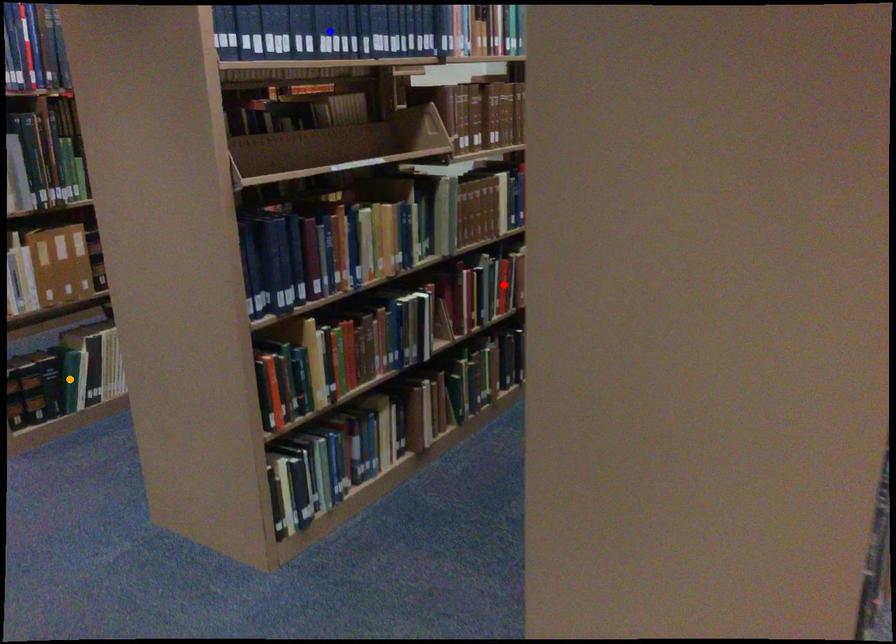
Order these from nearest to farthest:
blue point, red point, orange point

blue point → red point → orange point